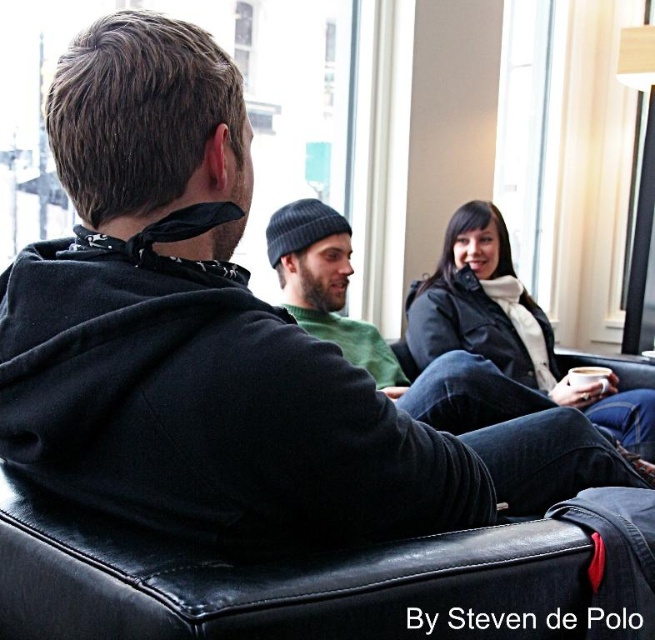
Between matte black jacket at center and green knit beanie at center, which one has more height?

matte black jacket at center is taller.

Between matte black jacket at center and green knit beanie at center, which one appears on the right side from the viewer's perspective?

matte black jacket at center

What do you see at coordinates (510, 326) in the screenshot? The image size is (655, 640). I see `matte black jacket at center` at bounding box center [510, 326].

Where is `matte black jacket at center`? The image size is (655, 640). matte black jacket at center is located at coordinates click(x=510, y=326).